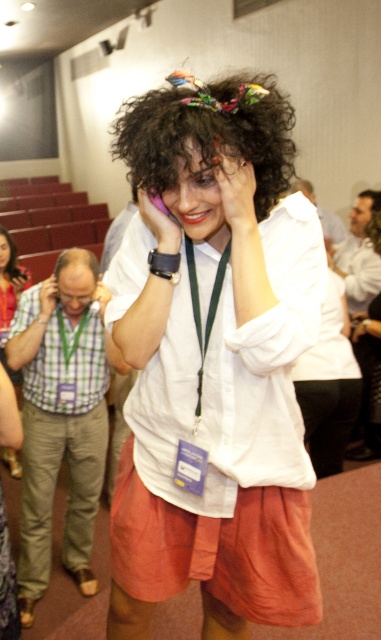
Can you confirm if matte black phone at upper left is thinner than dark curly hair at upper center?

Yes, matte black phone at upper left is thinner than dark curly hair at upper center.

Who is lower down, matte black phone at upper left or dark curly hair at upper center?

matte black phone at upper left is lower down.

Does point (43, 285) lie in front of point (11, 241)?

Yes, point (43, 285) is closer to viewer.

At what (x,y) coordinates should I click in order to perform the action: click on matte black phone at upper left. Please return your answer as a coordinate pair (x, y). The width and height of the screenshot is (381, 640). Looking at the image, I should click on (46, 298).

Between purple matte phone at upper center and smooth skin head at upper right, which one appears on the left side from the viewer's perspective?

purple matte phone at upper center

Is purple matte phone at upper center positioned behind smooth skin head at upper right?

No, it is not.

Which is behind, point (147, 204) or point (374, 196)?

The point (374, 196) is more distant.

Identify the location of purple matte phone at upper center. This screenshot has width=381, height=640. (160, 221).

Between point (152, 202) and point (51, 282), which one is positioned in front?

Point (152, 202) is in front.

Between point (153, 205) and point (43, 291), which one is positioned behind?

Point (43, 291)

Image resolution: width=381 pixels, height=640 pixels. What do you see at coordinates (160, 221) in the screenshot?
I see `purple matte phone at upper center` at bounding box center [160, 221].

Find the location of a particular element. The image size is (381, 640). purple matte phone at upper center is located at coordinates (160, 221).